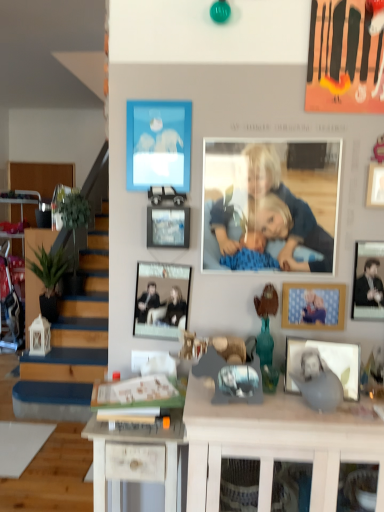
Question: Is blue fabric at center to the left or to the right of metallic black picture frame at center, which is the second picture frame in top-to-bottom order, in the image?

Choices:
 (A) left
 (B) right

Answer: (B)

Question: Does point (297, 232) appear closer or farther from the camera than point (173, 226)?

Choices:
 (A) closer
 (B) farther

Answer: (A)

Question: Which object is the farthest from the wooden bear at center?

Choices:
 (A) green matte plant at left
 (B) matte silver picture frame at center, arranged as the fifth picture frame when viewed from the top
 (C) white wood desk at center, the 2th desk viewed from the left
 (D) white wood cabinet at lower left
 (E) metallic black picture frame at center, the fourth picture frame in the bottom-to-top sequence

Answer: (D)

Question: Which of these objects is positioned farthest from the matte black picture frame at center, marked as the third picture frame in a top-to-bottom arrangement?

Choices:
 (A) wooden bear at center
 (B) matte silver picture frame at center, arranged as the fifth picture frame when viewed from the top
 (C) metallic black picture frame at center, which is the second picture frame in top-to-bottom order
 (D) white wood desk at center, positioned as the first desk in right-to-left order
 (E) wooden picture frame at center-right, the 4th picture frame from the top

Answer: (B)